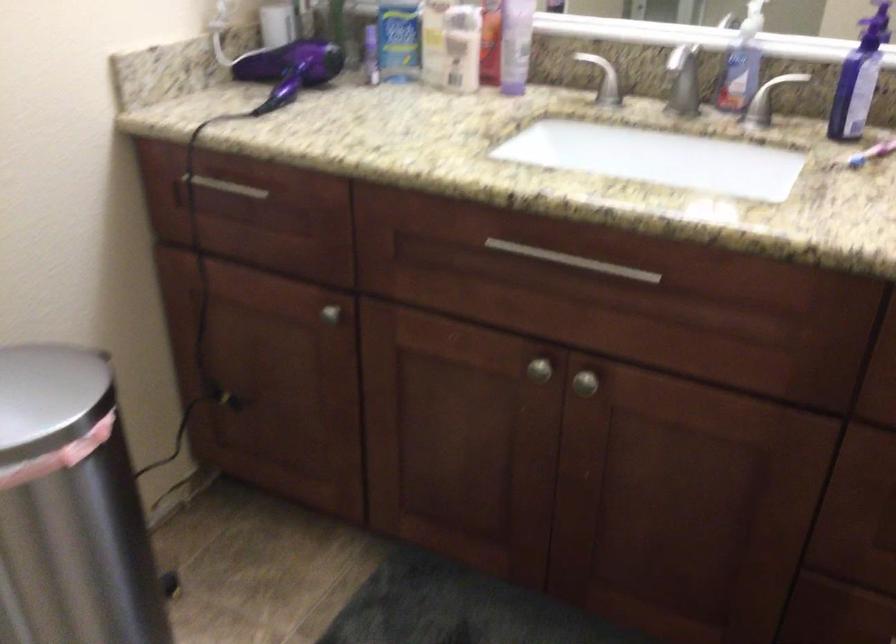
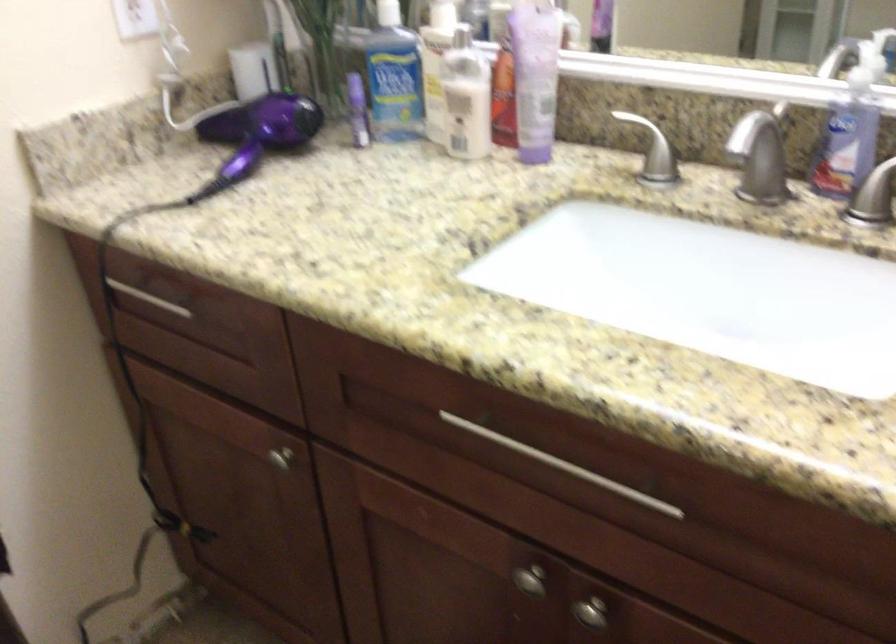
Where in the second image is the point corresponding to the point at 333,315 from the first image?

(280, 459)